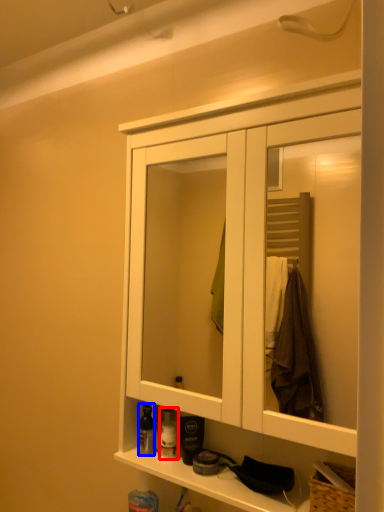
Question: Which point is further to the camera, toiletry (highlighted by a red box) or toiletry (highlighted by a blue box)?

Choices:
 (A) toiletry
 (B) toiletry

Answer: (A)